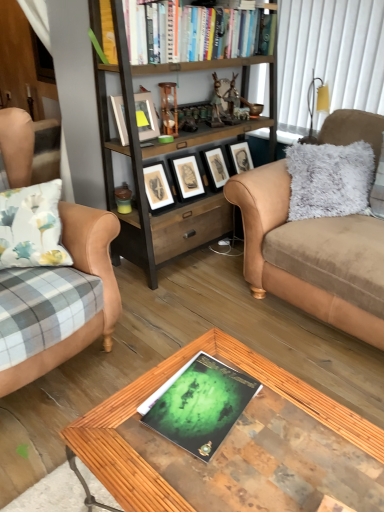
Question: From the image's perspective, is wooden glass coffee table at center located beneath matte black picture frame at center, which appears as the 2th picture frame when viewed from the front?

Choices:
 (A) yes
 (B) no

Answer: (A)

Question: Would you say wooden glass coffee table at center is a long distance from matte black picture frame at center, which is counted as the first picture frame, starting from the back?

Choices:
 (A) no
 (B) yes

Answer: (B)

Question: Is wooden glass coffee table at center thinner than matte black picture frame at center, placed as the second picture frame when sorted from left to right?

Choices:
 (A) no
 (B) yes

Answer: (A)

Question: Considering the relative sizes of wooden glass coffee table at center and matte black picture frame at center, which ranks as the 1th picture frame in right-to-left order, in the image provided, is wooden glass coffee table at center shorter than matte black picture frame at center, which ranks as the 1th picture frame in right-to-left order,?

Choices:
 (A) no
 (B) yes

Answer: (A)

Question: Considering the relative sizes of wooden glass coffee table at center and matte black picture frame at center, which appears as the 2th picture frame when viewed from the front, in the image provided, is wooden glass coffee table at center wider than matte black picture frame at center, which appears as the 2th picture frame when viewed from the front,?

Choices:
 (A) yes
 (B) no

Answer: (A)

Question: From a real-world perspective, is wooden glass coffee table at center physically located above or below tan leather couch at left, which is counted as the 1th studio couch, starting from the left?

Choices:
 (A) above
 (B) below

Answer: (B)

Question: From the image's perspective, relative to tan leather couch at left, acting as the 2th studio couch starting from the right, is wooden glass coffee table at center above or below?

Choices:
 (A) below
 (B) above

Answer: (A)

Question: Is point (155, 375) closer or farther from the camera than point (16, 114)?

Choices:
 (A) closer
 (B) farther

Answer: (A)

Question: Choose the correct answer: Is wooden glass coffee table at center inside tan leather couch at left, acting as the 2th studio couch starting from the right, or outside it?

Choices:
 (A) outside
 (B) inside

Answer: (A)

Question: Considering the positions of point (253, 392) and point (11, 147), is point (253, 392) closer or farther from the camera than point (11, 147)?

Choices:
 (A) farther
 (B) closer

Answer: (B)

Question: In the image, is green matte magazine at center positioned in front of or behind tan leather couch at left, acting as the 2th studio couch starting from the right?

Choices:
 (A) behind
 (B) front

Answer: (B)

Question: From a real-world perspective, is green matte magazine at center physically located above or below tan leather couch at left, which is counted as the 1th studio couch, starting from the left?

Choices:
 (A) below
 (B) above

Answer: (A)

Question: Is green matte magazine at center taller or shorter than tan leather couch at left, which is counted as the 1th studio couch, starting from the left?

Choices:
 (A) tall
 (B) short

Answer: (B)

Question: In terms of width, does woodenmaterial/texture bookcase at center look wider or thinner when compared to tan leather couch at left, which is counted as the 1th studio couch, starting from the left?

Choices:
 (A) wide
 (B) thin

Answer: (B)

Question: From a real-world perspective, is woodenmaterial/texture bookcase at center physically located above or below tan leather couch at left, acting as the 2th studio couch starting from the right?

Choices:
 (A) above
 (B) below

Answer: (A)